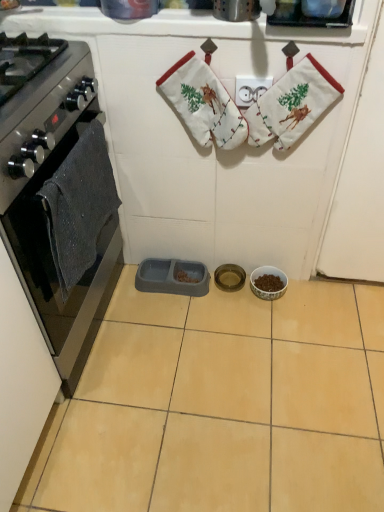
Question: From a real-world perspective, is beige ceramic tile at center above or below metallic gold bowl at center, arranged as the 2th appliance when viewed from the right?

Choices:
 (A) above
 (B) below

Answer: (B)

Question: Considering the relative positions of beige ceramic tile at center and metallic gold bowl at center, which ranks as the second appliance in left-to-right order, in the image provided, is beige ceramic tile at center to the left or to the right of metallic gold bowl at center, which ranks as the second appliance in left-to-right order,?

Choices:
 (A) left
 (B) right

Answer: (A)

Question: Based on their relative distances, which object is farther from the white cotton hand towel at upper center, which appears as the second hand towel when viewed from the left?

Choices:
 (A) black glass oven at left
 (B) dark gray knitted hand towel at left, marked as the second hand towel in a right-to-left arrangement
 (C) beige ceramic tile at center
 (D) metallic gold bowl at center, arranged as the 2th appliance when viewed from the right
 (E) porcelain bowl at center, the third appliance in the left-to-right sequence

Answer: (C)

Question: Based on their relative distances, which object is nearer to the beige ceramic tile at center?

Choices:
 (A) dark gray knitted hand towel at left, acting as the 1th hand towel starting from the left
 (B) porcelain bowl at center, which is the first appliance from right to left
 (C) white cotton hand towel at upper center, which appears as the second hand towel when viewed from the left
 (D) white fabric stocking at upper center
 (E) metallic gold bowl at center, which ranks as the second appliance in left-to-right order

Answer: (B)